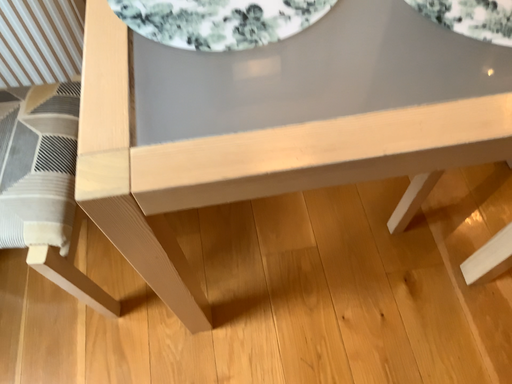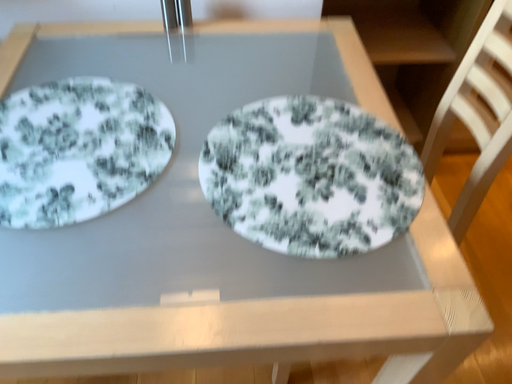
Question: How did the camera likely rotate when shooting the video?

Choices:
 (A) rotated upward
 (B) rotated downward

Answer: (A)